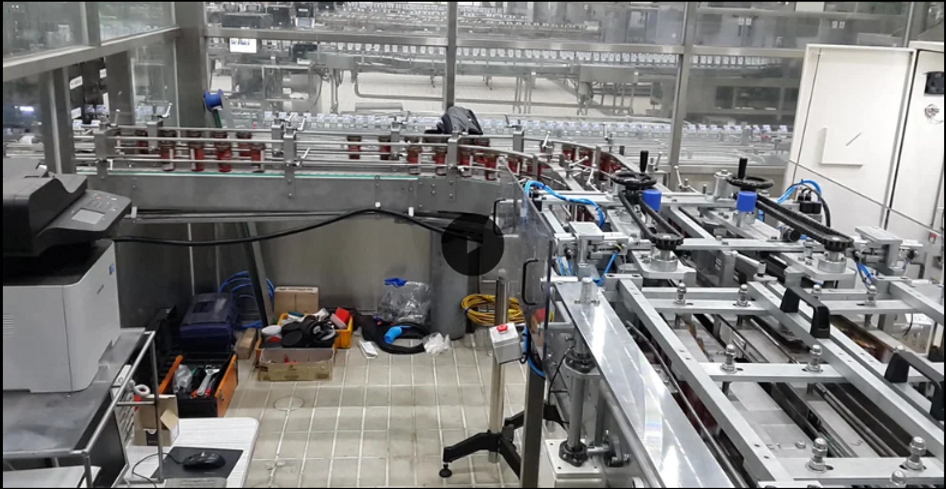
The width and height of the screenshot is (946, 489). Find the location of `yellow extension cord`. yellow extension cord is located at coordinates (463, 307).